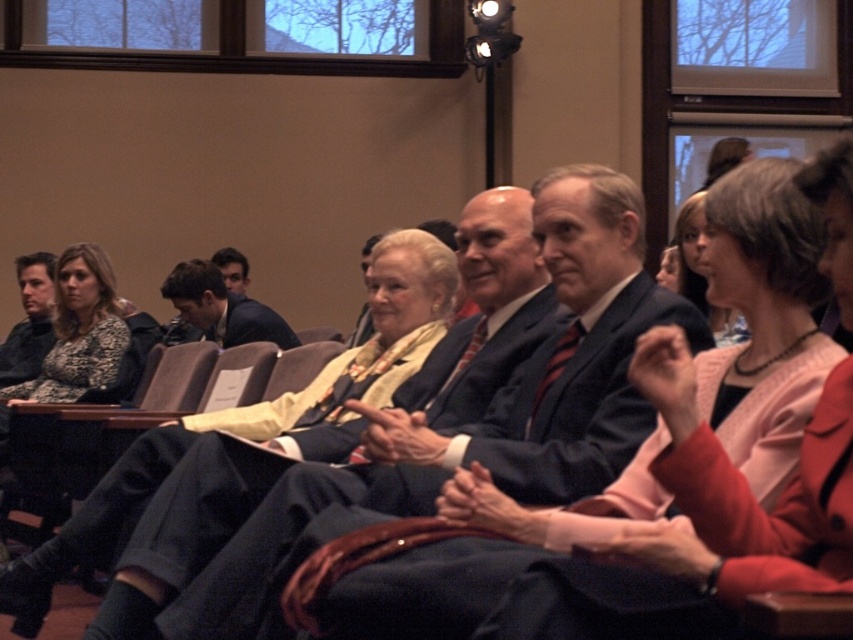
Is matte black suit at center bigger than leopard print sweater at left?

Yes, matte black suit at center is bigger than leopard print sweater at left.

Which is behind, point (196, 476) or point (76, 305)?

The point (76, 305) is more distant.

This screenshot has width=853, height=640. Identify the location of matte black suit at center. (396, 422).

Does matte black suit at center lie behind dark blue suit at center?

No, it is not.

Where is `matte black suit at center`? matte black suit at center is located at coordinates (396, 422).

Is point (329, 490) positioned behind point (161, 294)?

That is False.

Find the location of a particular element. matte black suit at center is located at coordinates (396, 422).

Which is in front, point (119, 349) or point (200, 280)?

Positioned in front is point (119, 349).

Is leopard print sweater at left to the left of dark blue suit at center from the viewer's perspective?

Indeed, leopard print sweater at left is positioned on the left side of dark blue suit at center.

Where is `leopard print sweater at left`? leopard print sweater at left is located at coordinates (74, 337).

The image size is (853, 640). I want to click on leopard print sweater at left, so click(74, 337).